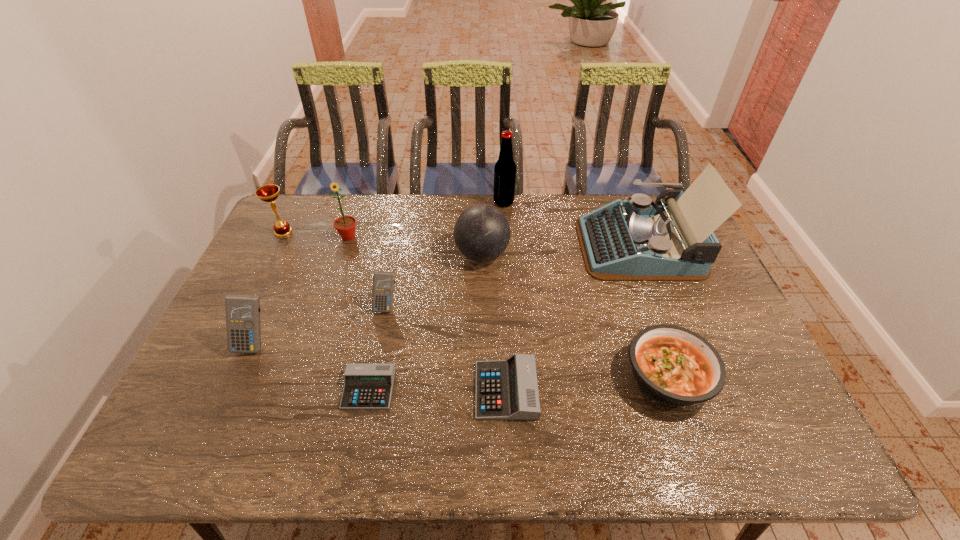
Find the location of a particular element. This screenshot has height=540, width=960. the farthest object is located at coordinates (505, 168).

Where is `blue typewriter`? blue typewriter is located at coordinates (639, 240).

Identify the location of green sunflower. The width and height of the screenshot is (960, 540). (345, 225).

I want to click on the third object from left to right, so (345, 225).

Where is `bowling ball`? This screenshot has width=960, height=540. bowling ball is located at coordinates (482, 233).

This screenshot has width=960, height=540. I want to click on chalice, so click(269, 193).

The height and width of the screenshot is (540, 960). In order to click on the third nearest calculator in this screenshot , I will do `click(242, 311)`.

Find the location of a particular element. This screenshot has width=960, height=540. the leftmost calculator is located at coordinates (242, 311).

Image resolution: width=960 pixels, height=540 pixels. In order to click on the farther blue calculator in this screenshot , I will do `click(383, 282)`.

Where is `the farthest calculator`? the farthest calculator is located at coordinates (383, 282).